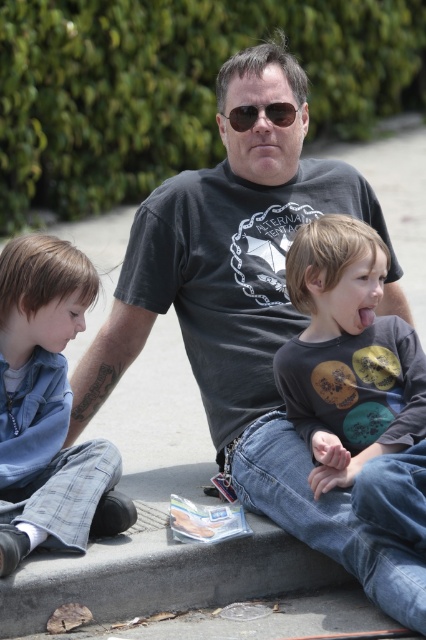
You are a fashion designer analyzing the image. You need to determine which item of clothing has a smaller size between the matte gray shirt at center and the blue denim pants at lower left. Which one is it?

The matte gray shirt at center has a smaller size compared to the blue denim pants at lower left, so the matte gray shirt at center is the smaller one.

You are standing at the origin point in the image. Which direction should you move to reach the blue denim pants at lower left?

The blue denim pants at lower left are located at coordinates point (46, 404). Since you are at the origin, you should move towards the lower left direction to reach them.